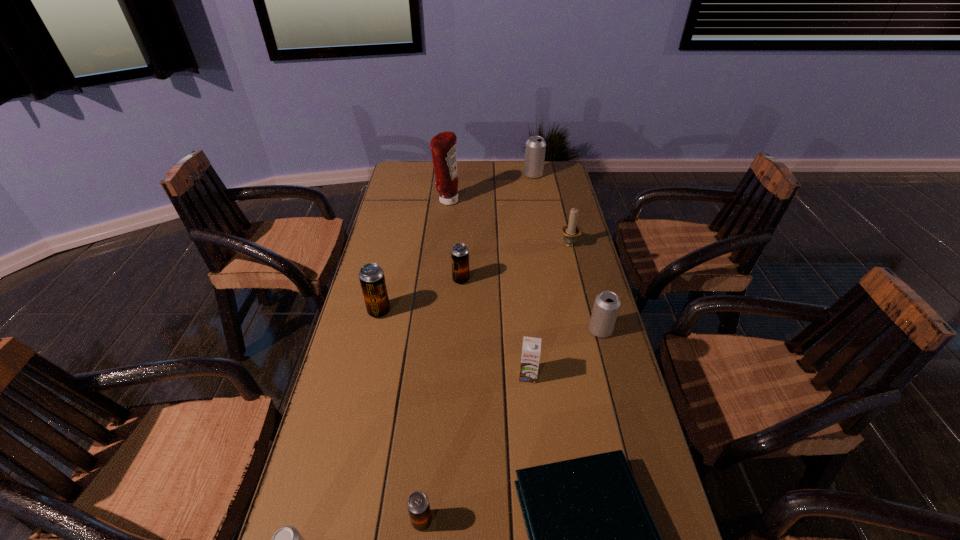
Locate an element on the screen. The width and height of the screenshot is (960, 540). free space located 0.320m on the handle side of the eighth nearest object is located at coordinates (556, 190).

What are the coordinates of `vacant space located on the right of the chocolate milk` in the screenshot? It's located at (615, 375).

Identify the location of vacant space located on the front of the rightmost black beer can. click(459, 319).

Locate an element on the screen. Image resolution: width=960 pixels, height=540 pixels. vacant space located on the left of the rightmost beer can is located at coordinates (466, 330).

At what (x,y) coordinates should I click in order to perform the action: click on vacant space located 0.340m on the right of the nearest black beer can. Please return your answer as a coordinate pair (x, y). The image size is (960, 540). Looking at the image, I should click on (602, 521).

What are the coordinates of `object situated at the far edge` in the screenshot? It's located at (535, 148).

This screenshot has width=960, height=540. Find the location of `object located in the left edge section of the desktop`. object located in the left edge section of the desktop is located at coordinates (371, 275).

The height and width of the screenshot is (540, 960). I want to click on candle_holder that is at the right edge, so click(x=571, y=231).

Find the location of `object at the far right corner`. object at the far right corner is located at coordinates (535, 148).

This screenshot has height=540, width=960. In order to click on free space at the far edge of the desktop in this screenshot , I will do `click(463, 162)`.